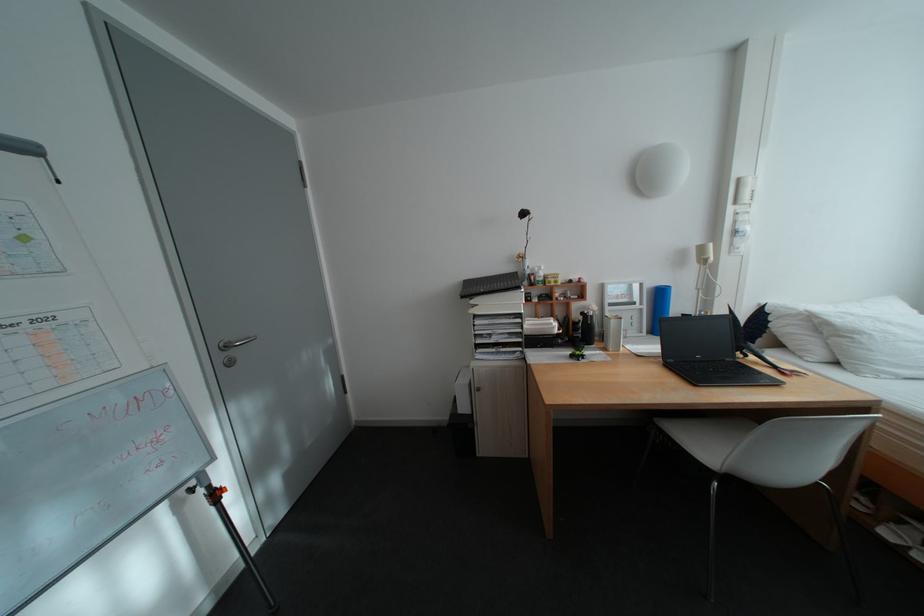
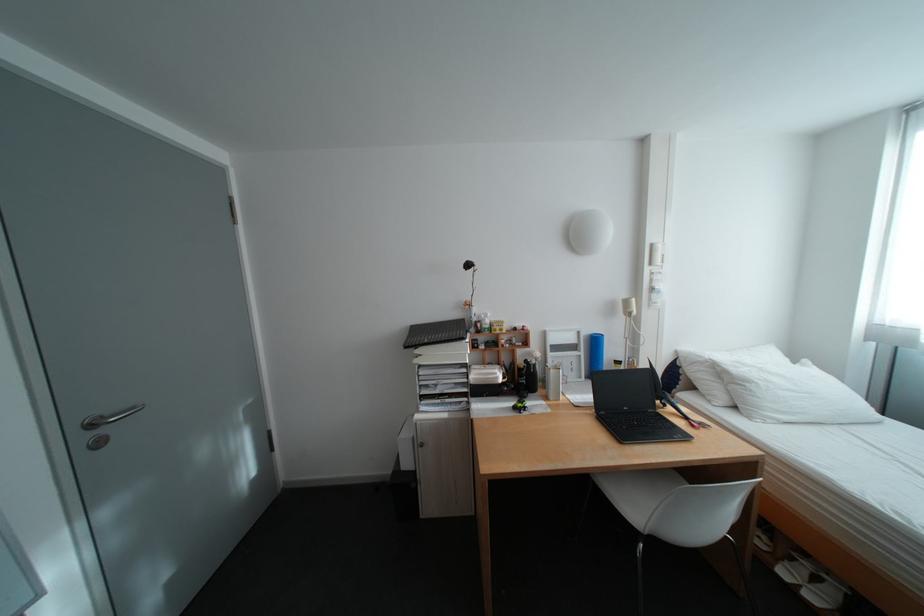
Locate, in the second image, the point that corresponds to point 535,314 in the first image.

(480, 363)